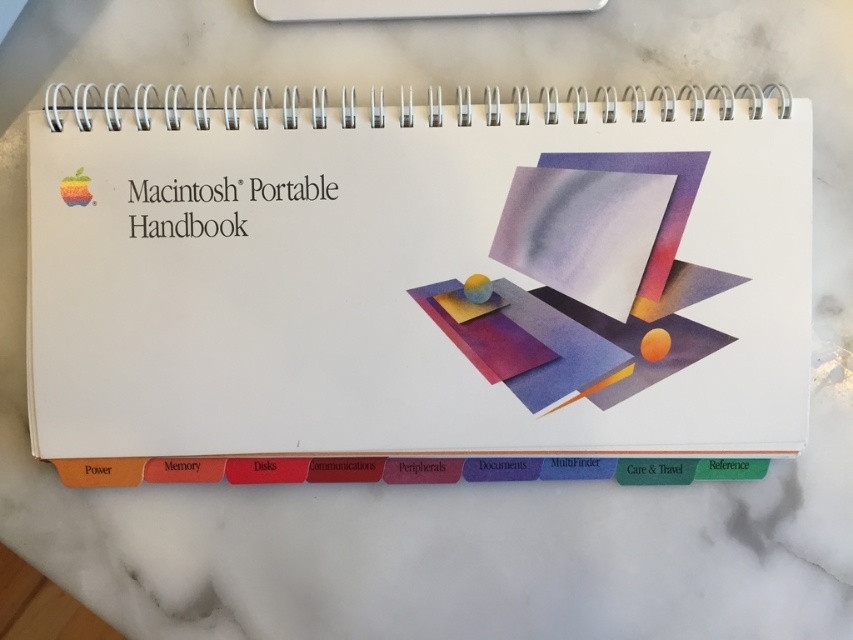
You are organizing a desk and need to place the white paper at center and the white plastic ruler at upper center. If you want to place a small sticker on the larger object, which one should you choose?

The white paper at center is bigger than the white plastic ruler at upper center, so you should place the sticker on the white paper at center.

You are organizing a desk and notice the white paper at center and the white plastic ruler at upper center. Which object is located lower on the desk?

The white paper at center is positioned under the white plastic ruler at upper center, so it is located lower on the desk.

You are organizing a desk and need to place the white paper at center and the white plastic ruler at upper center. Considering their sizes, which object should you place first to ensure stability?

The white paper at center is much taller than the white plastic ruler at upper center, so you should place the white paper at center first to ensure stability.